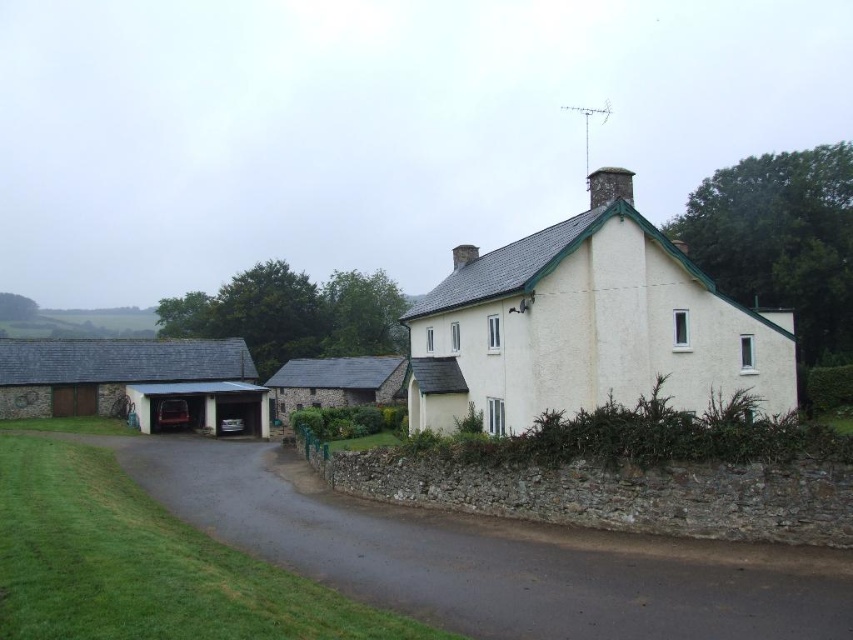
Who is more forward, (735,321) or (376,380)?

Point (735,321) is in front.

How much distance is there between white stucco cottage at center and stone slate roof cottage at center?

white stucco cottage at center and stone slate roof cottage at center are 25.20 meters apart from each other.

The height and width of the screenshot is (640, 853). I want to click on white stucco cottage at center, so click(585, 328).

Which of these two, stone slate roofed garage at left or stone slate roof cottage at center, stands shorter?

With less height is stone slate roof cottage at center.

Is stone slate roofed garage at left in front of stone slate roof cottage at center?

That is True.

Which is behind, point (0, 368) or point (396, 365)?

Positioned behind is point (396, 365).

This screenshot has height=640, width=853. What are the coordinates of `stone slate roofed garage at left` in the screenshot? It's located at (135, 381).

Looking at this image, does white stucco cottage at center have a lesser height compared to dark gray stone chimney at upper center?

Correct, white stucco cottage at center is not as tall as dark gray stone chimney at upper center.

Consider the image. Is white stucco cottage at center taller than dark gray stone chimney at upper center?

No, white stucco cottage at center is not taller than dark gray stone chimney at upper center.

Find the location of a particular element. white stucco cottage at center is located at coordinates (585, 328).